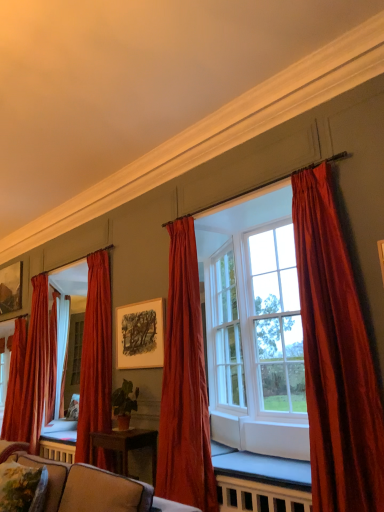
Question: Is point (3, 468) positioned closer to the camera than point (19, 408)?

Choices:
 (A) closer
 (B) farther

Answer: (A)

Question: Considering their positions, is velvet floral pillow at lower left located in front of or behind velvet red curtain at left, positioned as the 1th curtain in back-to-front order?

Choices:
 (A) front
 (B) behind

Answer: (A)

Question: Estimate the real-world distances between objects in this image. Which object is closer to the satin red curtain at left, the 3th curtain viewed from the front?

Choices:
 (A) green matte plant at center
 (B) velvet floral pillow at lower left
 (C) velvet red curtain at center, the 4th curtain positioned from the left
 (D) velvet curtains at center
 (E) matte black picture frame at upper left, marked as the first picture frame in a left-to-right arrangement

Answer: (A)

Question: Considering the real-world distances, which object is farthest from the matte white picture frame at center, which is counted as the second picture frame, starting from the left?

Choices:
 (A) velvet red curtain at left, positioned as the 4th curtain in right-to-left order
 (B) velvet floral pillow at lower left
 (C) velvet red curtain at left, which appears as the 5th curtain when viewed from the right
 (D) green matte plant at center
 (E) satin red curtain at left, which ranks as the 3th curtain in left-to-right order

Answer: (B)